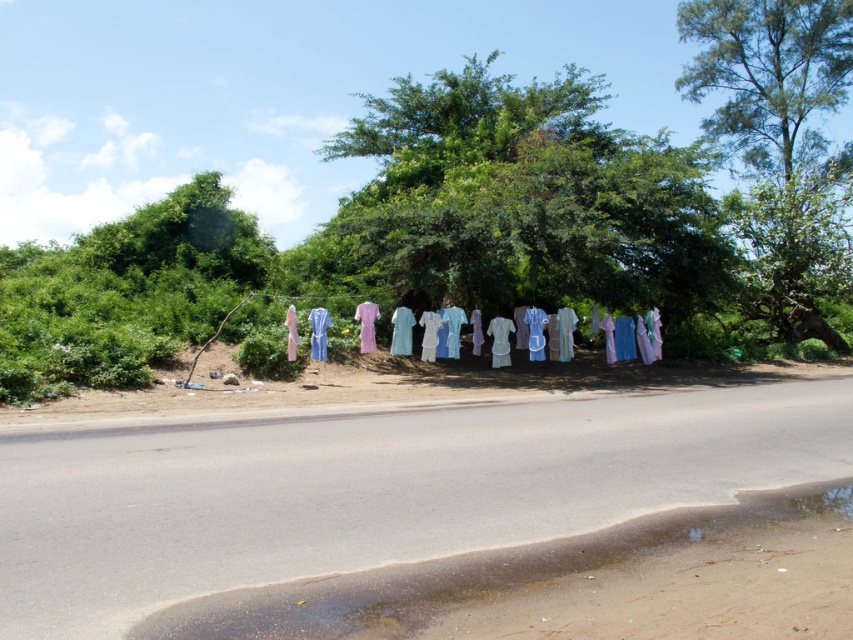
Between point (519, 189) and point (520, 637), which one is positioned behind?

The point (519, 189) is behind.

Between green leafy tree at center and brown wet asphalt at lower center, which one appears on the right side from the viewer's perspective?

green leafy tree at center

Measure the distance between green leafy tree at center and camera.

green leafy tree at center and camera are 17.97 meters apart from each other.

The image size is (853, 640). I want to click on green leafy tree at center, so [x=527, y=198].

Does green leafy tree at center appear on the right side of green leafy tree at upper right?

No, green leafy tree at center is not to the right of green leafy tree at upper right.

Does green leafy tree at center have a larger size compared to green leafy tree at upper right?

Yes, green leafy tree at center is bigger than green leafy tree at upper right.

At what (x,y) coordinates should I click in order to perform the action: click on green leafy tree at center. Please return your answer as a coordinate pair (x, y). The width and height of the screenshot is (853, 640). Looking at the image, I should click on (527, 198).

I want to click on green leafy tree at center, so click(x=527, y=198).

Is point (410, 596) more distant than point (759, 177)?

No, it is not.

Is brown wet asphalt at lower center taller than green leafy tree at upper right?

No, brown wet asphalt at lower center is not taller than green leafy tree at upper right.

Which is in front, point (416, 620) or point (688, 93)?

Point (416, 620) is in front.

Find the location of `brown wet asphalt at lower center`. brown wet asphalt at lower center is located at coordinates (x=581, y=582).